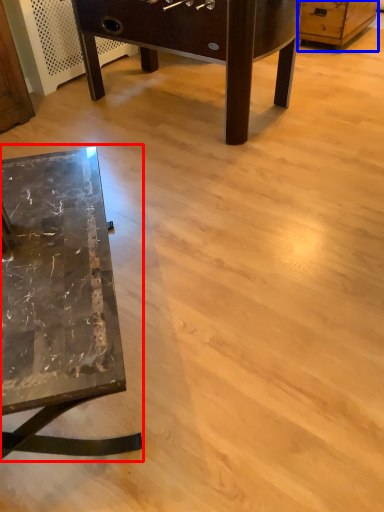
Question: Among these objects, which one is nearest to the camera, table (highlighted by a red box) or dresser (highlighted by a blue box)?

Choices:
 (A) table
 (B) dresser

Answer: (A)